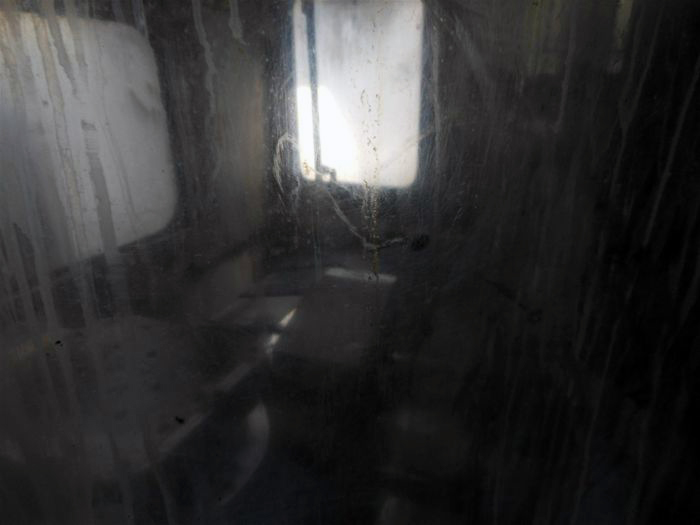
Where is `chair`? chair is located at coordinates (256, 319).